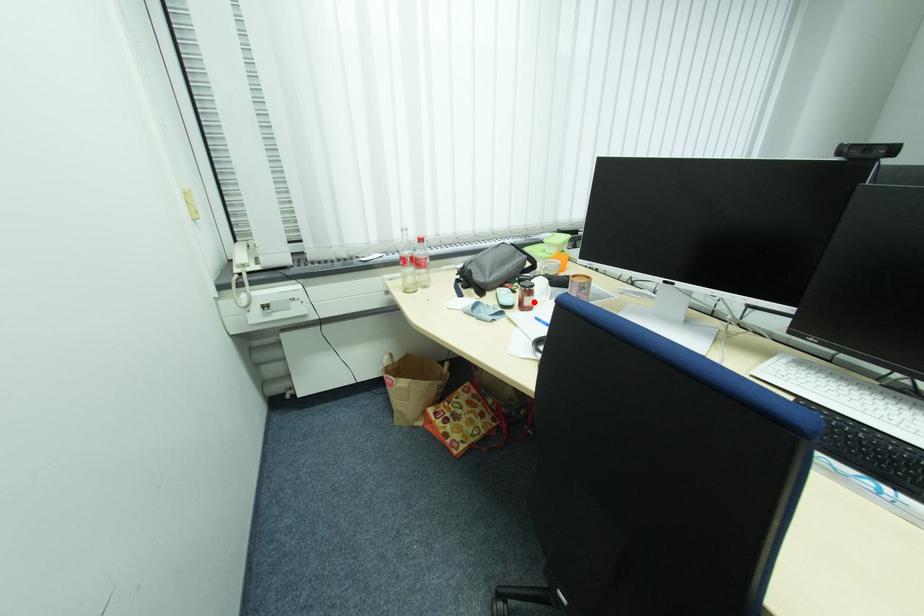
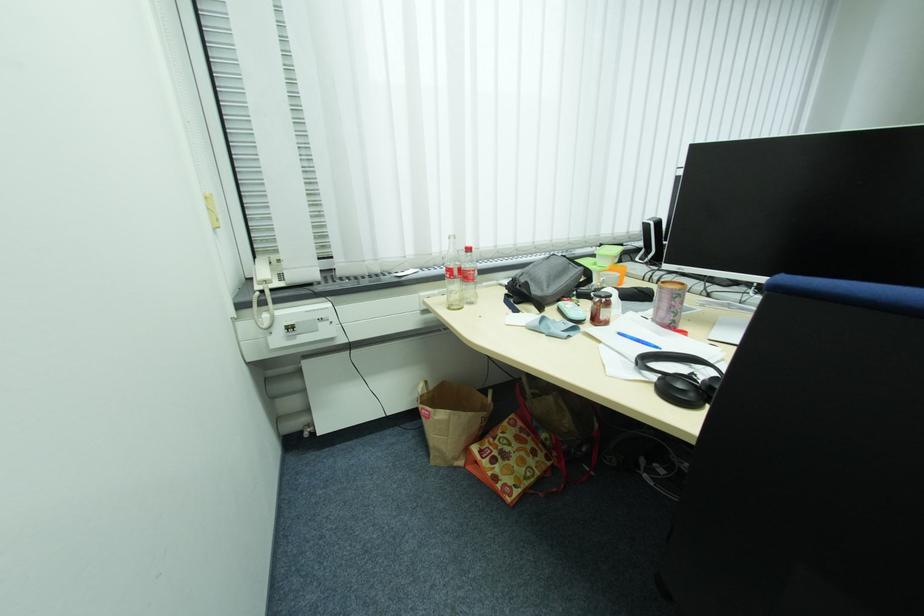
Locate, in the second image, the point that corresponds to the highlighted location in the first image.

(610, 315)